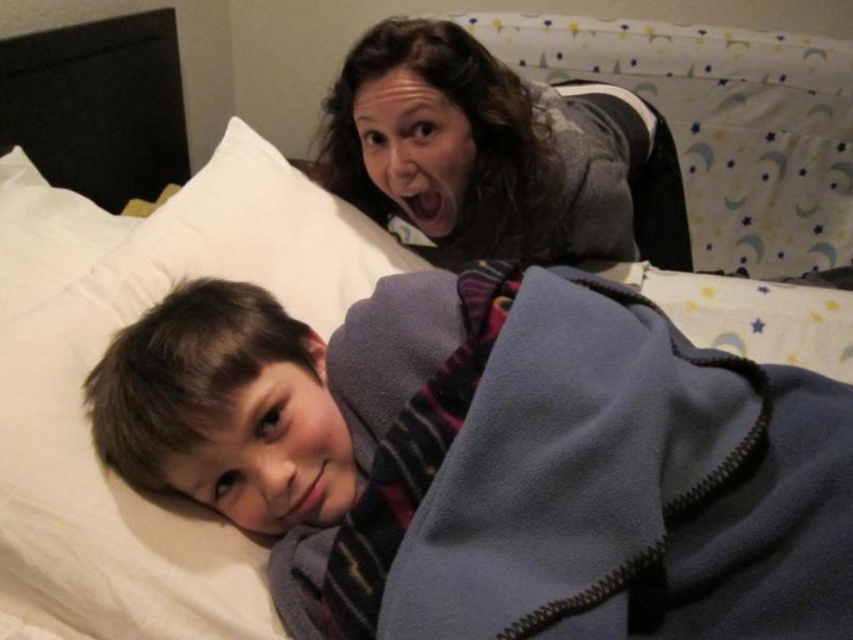
You are a photographer taking a picture of the fleece at lower left and the white soft pillow at upper center. To ensure both items are in focus, you need to know which one is closer to the camera. Can you determine which item is closer?

The fleece at lower left is in front of the white soft pillow at upper center, so it is closer to the camera.

You are a photographer setting up a shoot in this scene. You need to place a small prop between the fleece at lower left and the gray fleece at upper center. Based on their heights, which fleece should the prop be placed closer to?

The fleece at lower left is shorter than the gray fleece at upper center, so the prop should be placed closer to the fleece at lower left to maintain visual balance.